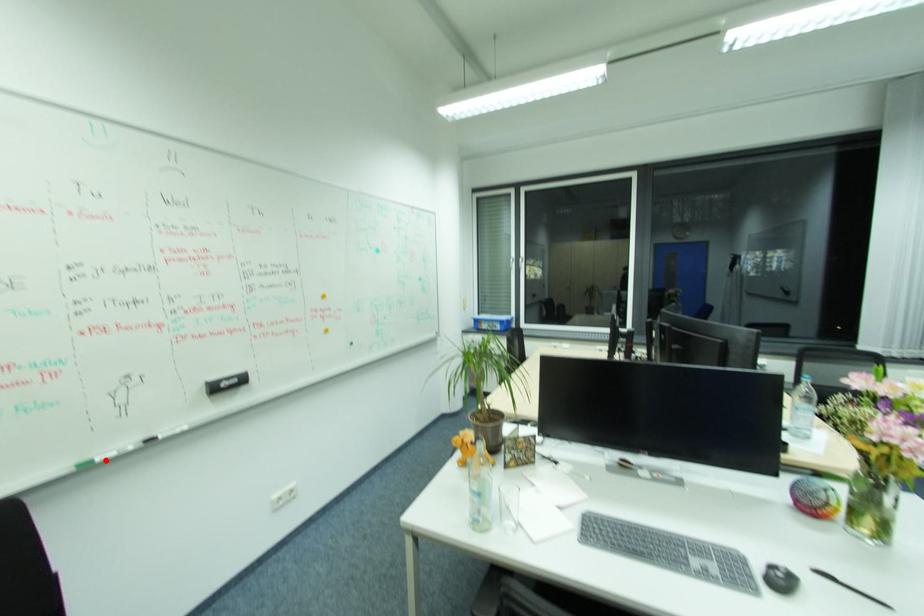
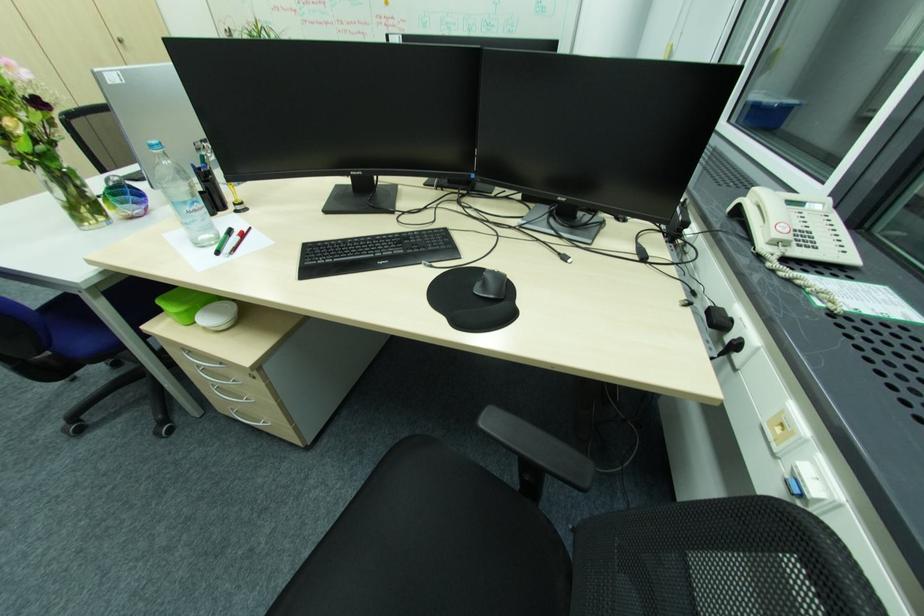
Question: I am providing you with two images of the same scene from different viewpoints. A red point is marked on the first image. Can you still see the location of the red point in image 2?

Choices:
 (A) Yes
 (B) No

Answer: (B)